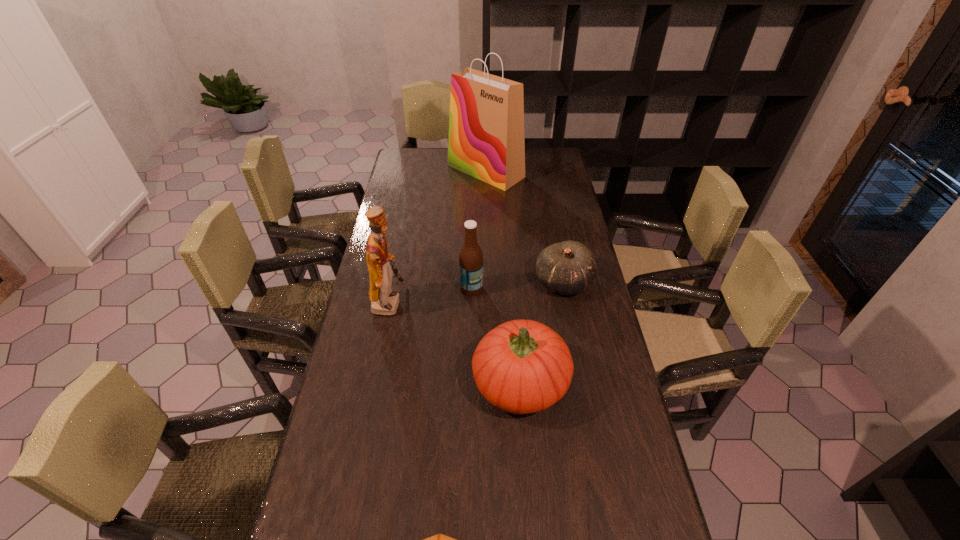
Find the location of a particular element. The width and height of the screenshot is (960, 540). vacant space located 0.210m on the right of the beer bottle is located at coordinates (545, 288).

The height and width of the screenshot is (540, 960). What are the coordinates of `free space located on the left of the third shortest object` in the screenshot? It's located at (415, 382).

The height and width of the screenshot is (540, 960). Identify the location of free space located 0.250m on the left of the farther gourd. (461, 282).

Where is `object that is at the far edge`? The width and height of the screenshot is (960, 540). object that is at the far edge is located at coordinates click(x=486, y=140).

Locate an element on the screen. The height and width of the screenshot is (540, 960). object positioned at the left edge is located at coordinates (384, 301).

Where is `pumpkin at the right edge`? The height and width of the screenshot is (540, 960). pumpkin at the right edge is located at coordinates (522, 366).

The height and width of the screenshot is (540, 960). Identify the location of gourd at the right edge. (567, 268).

In the image, there is a desktop. Identify the location of vacant area at the left edge. (373, 447).

Identify the location of blank space at the far left corner of the desktop. This screenshot has width=960, height=540. (428, 153).

I want to click on unoccupied area between the shopping bag and the fifth shortest object, so click(x=438, y=237).